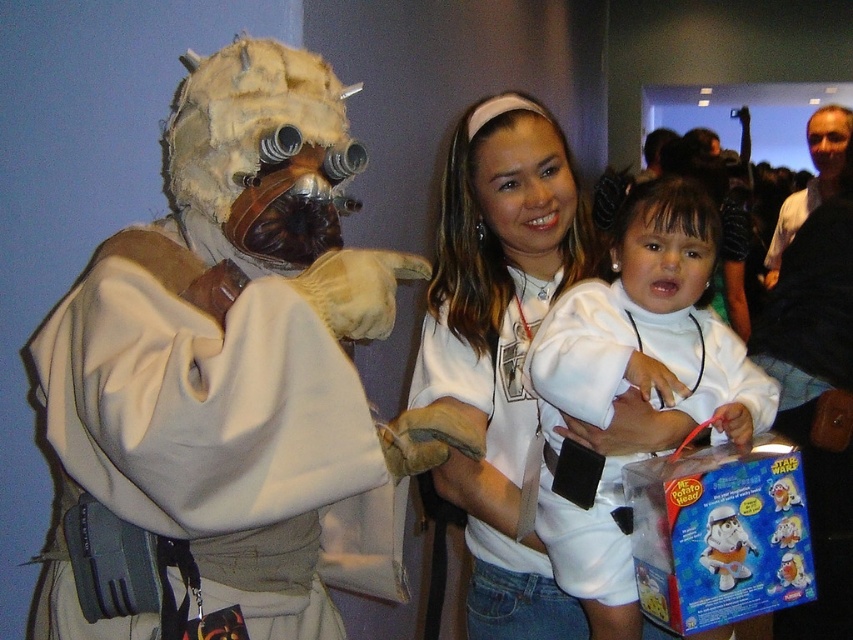
Question: Considering the real-world distances, which object is farthest from the white matte shirt at center?

Choices:
 (A) plush white toy at lower right
 (B) white matte/soft fabric child at center

Answer: (A)

Question: Does fuzzy beige costume at left appear on the left side of plastic toy at center?

Choices:
 (A) yes
 (B) no

Answer: (A)

Question: Considering the real-world distances, which object is farthest from the plastic toy at center?

Choices:
 (A) white matte shirt at center
 (B) fuzzy beige costume at left

Answer: (B)

Question: Is fuzzy beige costume at left wider than plastic toy at center?

Choices:
 (A) yes
 (B) no

Answer: (A)

Question: Which of the following is the closest to the observer?

Choices:
 (A) fuzzy beige costume at left
 (B) white matte shirt at center

Answer: (A)

Question: Observing the image, what is the correct spatial positioning of fuzzy beige costume at left in reference to plush white toy at lower right?

Choices:
 (A) above
 (B) below

Answer: (A)